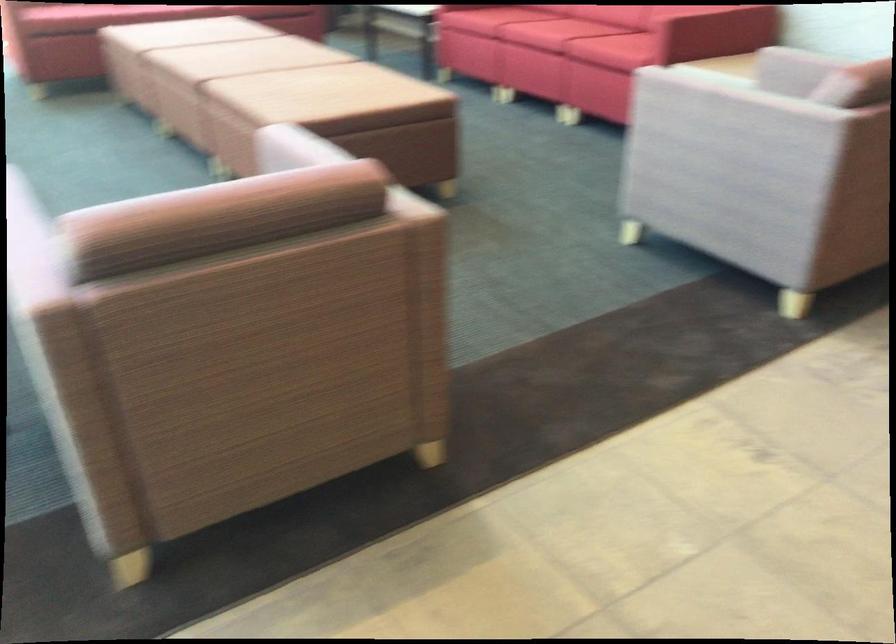
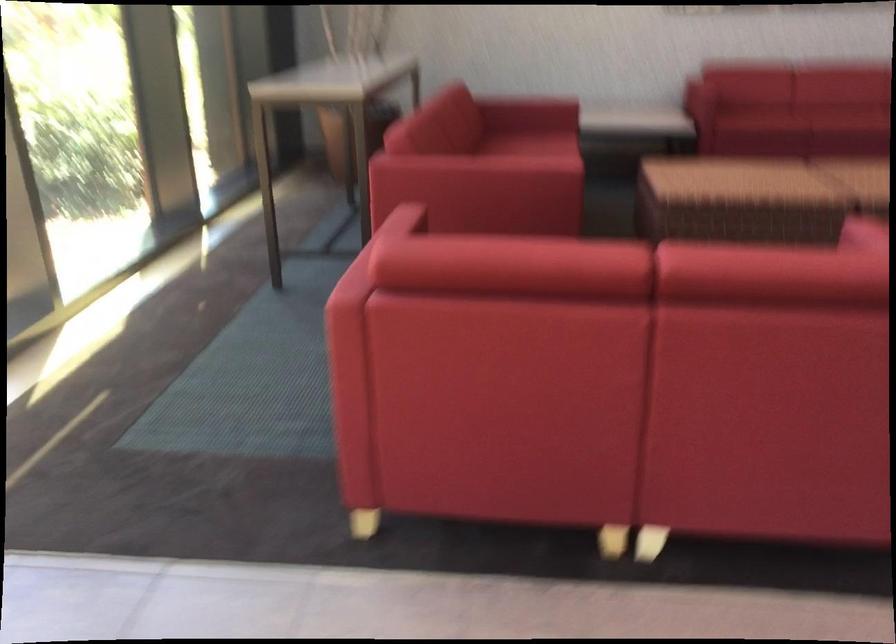
First-person continuous shooting, in which direction is the camera rotating?

The camera's rotation is toward right-down.